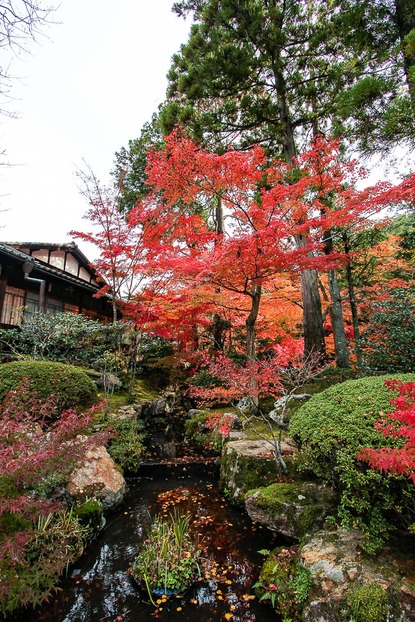
In order to click on green plants in this screenshot , I will do pyautogui.click(x=82, y=344), pyautogui.click(x=395, y=328).